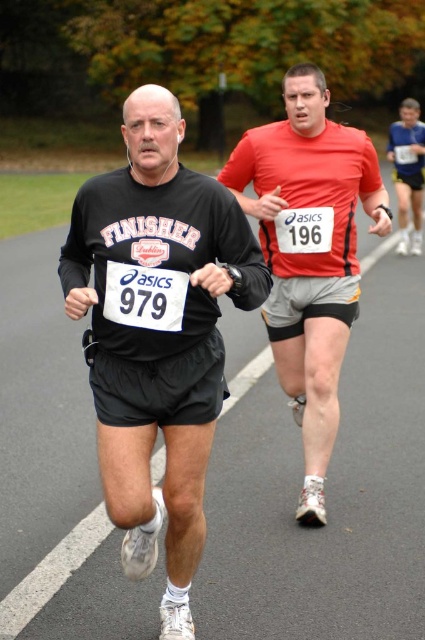
Question: Considering the relative positions of matte red shirt at center and matte red shorts at right in the image provided, where is matte red shirt at center located with respect to matte red shorts at right?

Choices:
 (A) left
 (B) right

Answer: (A)

Question: Which point appears farthest from the camera in this image?

Choices:
 (A) (119, 324)
 (B) (306, 481)

Answer: (B)

Question: Is matte red shirt at center above matte red shorts at right?

Choices:
 (A) yes
 (B) no

Answer: (B)

Question: Is black matte running shorts at left behind matte red shirt at center?

Choices:
 (A) yes
 (B) no

Answer: (B)

Question: Which point appears farthest from the camera in this image?

Choices:
 (A) (90, 294)
 (B) (394, 141)

Answer: (B)

Question: Which of the following is the farthest from the observer?

Choices:
 (A) (127, 396)
 (B) (289, 116)

Answer: (B)